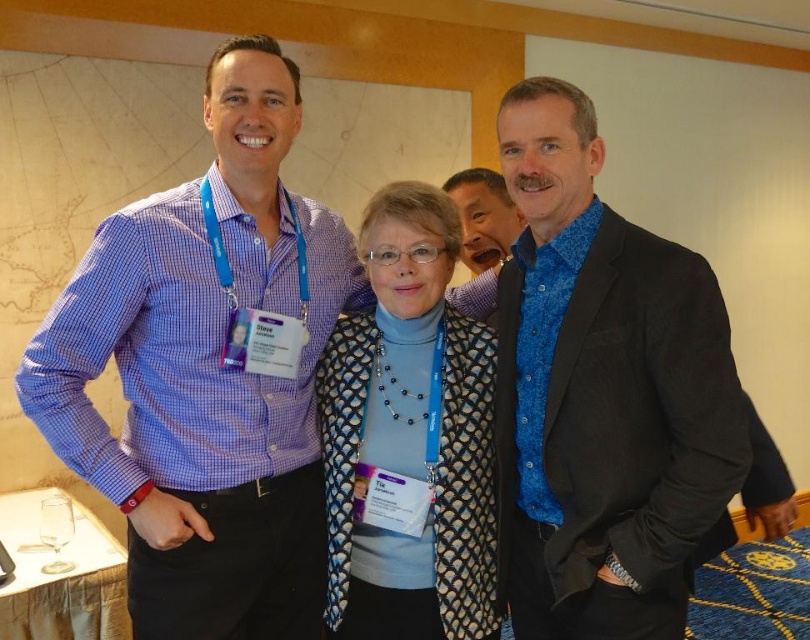
The height and width of the screenshot is (640, 810). I want to click on blue satin shirt at center, so click(602, 394).

Can you confirm if blue satin shirt at center is positioned below blue textured sweater at center?

No.

The width and height of the screenshot is (810, 640). Identify the location of blue satin shirt at center. (602, 394).

The width and height of the screenshot is (810, 640). Identify the location of blue satin shirt at center. (602, 394).

Between matte blue shirt at left and blue textured shirt at center, which one has more height?

Standing taller between the two is matte blue shirt at left.

Find the location of a particular element. Image resolution: width=810 pixels, height=640 pixels. matte blue shirt at left is located at coordinates (207, 372).

You are a GUI agent. You are given a task and a screenshot of the screen. Output one action in this format:
    pyautogui.click(x=<x>, y=<y>)
    Task: Click on the matte blue shirt at left
    This screenshot has height=640, width=810.
    Given the screenshot: What is the action you would take?
    pyautogui.click(x=207, y=372)